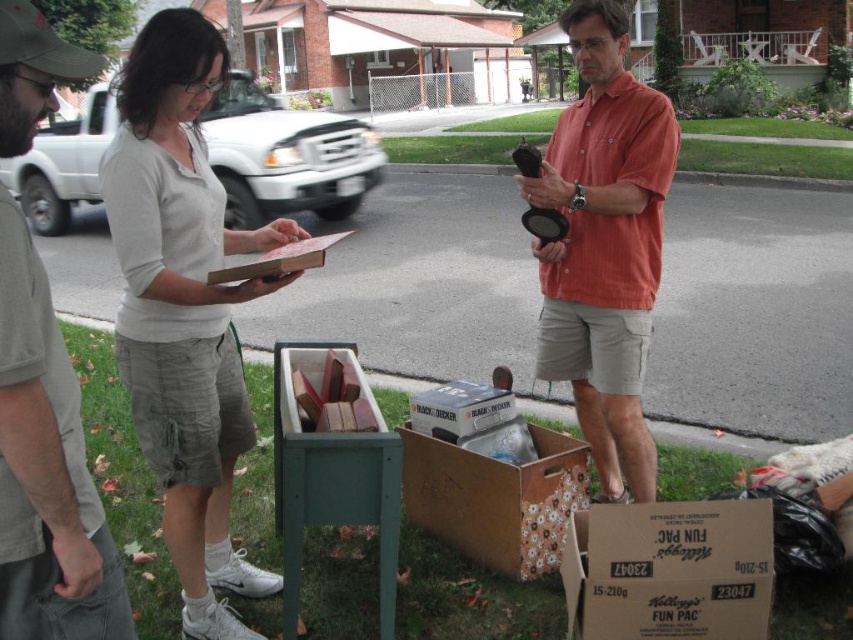
Question: Based on their relative distances, which object is nearer to the gray cotton t-shirt at left?

Choices:
 (A) floral cardboard box at lower center
 (B) cardboard box at lower right

Answer: (B)

Question: Is gray cotton t-shirt at left to the right of floral cardboard box at lower center from the viewer's perspective?

Choices:
 (A) yes
 (B) no

Answer: (B)

Question: Is white matte shirt at upper left wider than black cardboard box at center?

Choices:
 (A) no
 (B) yes

Answer: (B)

Question: Which object is the farthest from the gray cotton t-shirt at left?

Choices:
 (A) matte orange shirt at center
 (B) cardboard box at lower right
 (C) floral cardboard box at lower center
 (D) black cardboard box at center

Answer: (A)

Question: Considering the real-world distances, which object is closest to the floral cardboard box at lower center?

Choices:
 (A) white matte shirt at upper left
 (B) gray cotton t-shirt at left
 (C) black cardboard box at center

Answer: (C)

Question: Does cardboard box at lower right have a lesser width compared to black cardboard box at center?

Choices:
 (A) no
 (B) yes

Answer: (A)